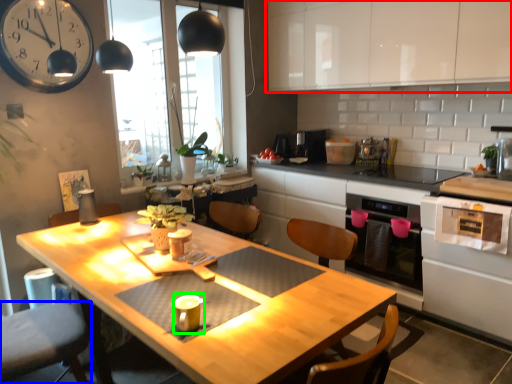
Question: Estimate the real-world distances between objects in this image. Which object is farther from cabinetry (highlighted by a red box), swivel chair (highlighted by a blue box) or appliance (highlighted by a green box)?

Choices:
 (A) swivel chair
 (B) appliance

Answer: (A)